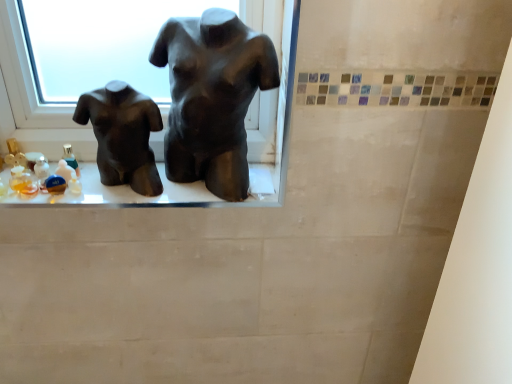
Question: Can you confirm if matte black mannequin torso at center is bigger than matte black torso at center, which is the 1th statue (sculpture) in right-to-left order?

Choices:
 (A) yes
 (B) no

Answer: (B)

Question: Is matte black torso at center, the 2th statue (sculpture) from the left, a part of matte black mannequin torso at center?

Choices:
 (A) yes
 (B) no

Answer: (B)

Question: Is the position of matte black mannequin torso at center less distant than that of matte black torso at center, the 2th statue (sculpture) from the left?

Choices:
 (A) yes
 (B) no

Answer: (B)

Question: From the image's perspective, does matte black mannequin torso at center appear higher than matte black torso at center, the 2th statue (sculpture) from the left?

Choices:
 (A) no
 (B) yes

Answer: (A)

Question: From a real-world perspective, is matte black mannequin torso at center positioned over matte black torso at center, the 2th statue (sculpture) from the left, based on gravity?

Choices:
 (A) no
 (B) yes

Answer: (A)

Question: Is matte black torso at left, which ranks as the 2th statue (sculpture) in right-to-left order, taller or shorter than matte black torso at center, the 2th statue (sculpture) from the left?

Choices:
 (A) tall
 (B) short

Answer: (B)

Question: From a real-world perspective, relative to matte black torso at center, which is the 1th statue (sculpture) in right-to-left order, is matte black torso at left, which ranks as the 2th statue (sculpture) in right-to-left order, vertically above or below?

Choices:
 (A) above
 (B) below

Answer: (B)

Question: Is matte black torso at left, which appears as the first statue (sculpture) when viewed from the left, bigger or smaller than matte black torso at center, the 2th statue (sculpture) from the left?

Choices:
 (A) small
 (B) big

Answer: (A)

Question: Is matte black torso at left, which appears as the first statue (sculpture) when viewed from the left, to the left or to the right of matte black torso at center, which is the 1th statue (sculpture) in right-to-left order, in the image?

Choices:
 (A) left
 (B) right

Answer: (A)

Question: Would you say matte black torso at left, which appears as the first statue (sculpture) when viewed from the left, is to the left or to the right of matte black mannequin torso at center in the picture?

Choices:
 (A) left
 (B) right

Answer: (A)

Question: Considering the positions of matte black torso at left, which appears as the first statue (sculpture) when viewed from the left, and matte black mannequin torso at center in the image, is matte black torso at left, which appears as the first statue (sculpture) when viewed from the left, bigger or smaller than matte black mannequin torso at center?

Choices:
 (A) small
 (B) big

Answer: (B)

Question: Is matte black torso at left, which appears as the first statue (sculpture) when viewed from the left, situated inside matte black mannequin torso at center or outside?

Choices:
 (A) inside
 (B) outside

Answer: (B)

Question: In terms of height, does matte black torso at left, which appears as the first statue (sculpture) when viewed from the left, look taller or shorter compared to matte black mannequin torso at center?

Choices:
 (A) tall
 (B) short

Answer: (A)

Question: Would you say matte black mannequin torso at center is to the left or to the right of matte black torso at left, which appears as the first statue (sculpture) when viewed from the left, in the picture?

Choices:
 (A) left
 (B) right

Answer: (B)

Question: Would you say matte black mannequin torso at center is inside or outside matte black torso at left, which ranks as the 2th statue (sculpture) in right-to-left order?

Choices:
 (A) outside
 (B) inside

Answer: (A)